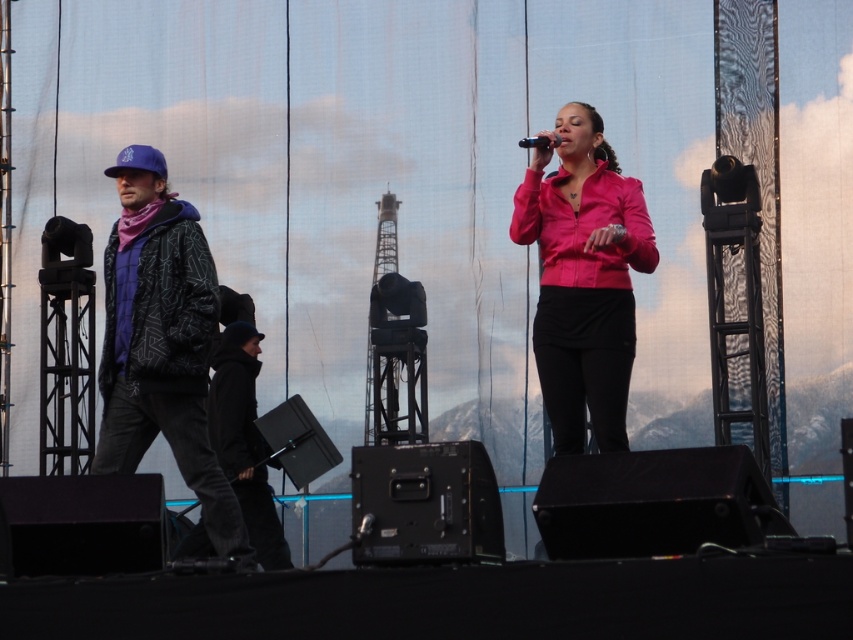
You are a stagehand who needs to retrieve the matte black jacket at left and the black matte microphone at center for a quick costume change. Given that you can carry both items at once, what is the minimum distance you must walk to collect both items?

The minimum distance you must walk is 9.01 meters, which is the distance between the matte black jacket at left and the black matte microphone at center.